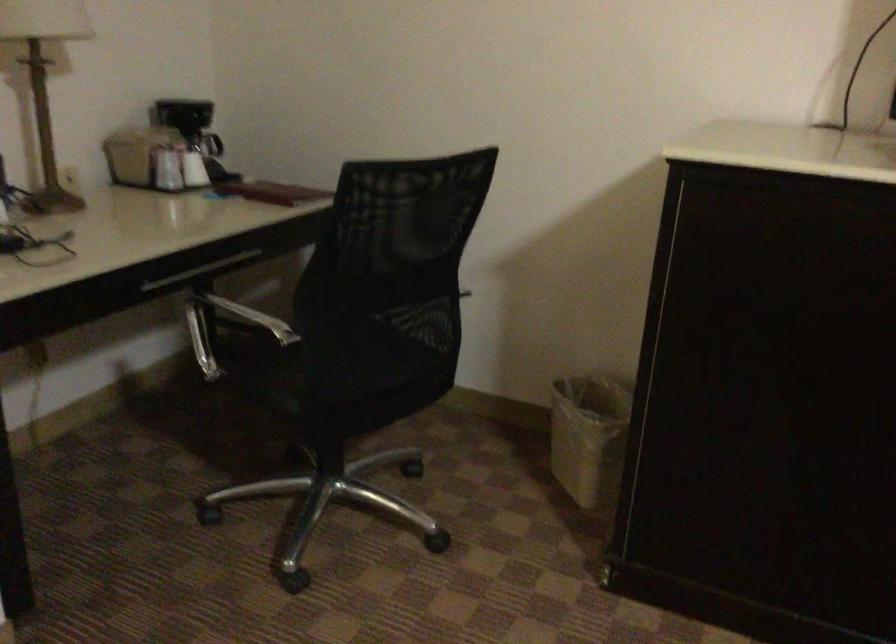
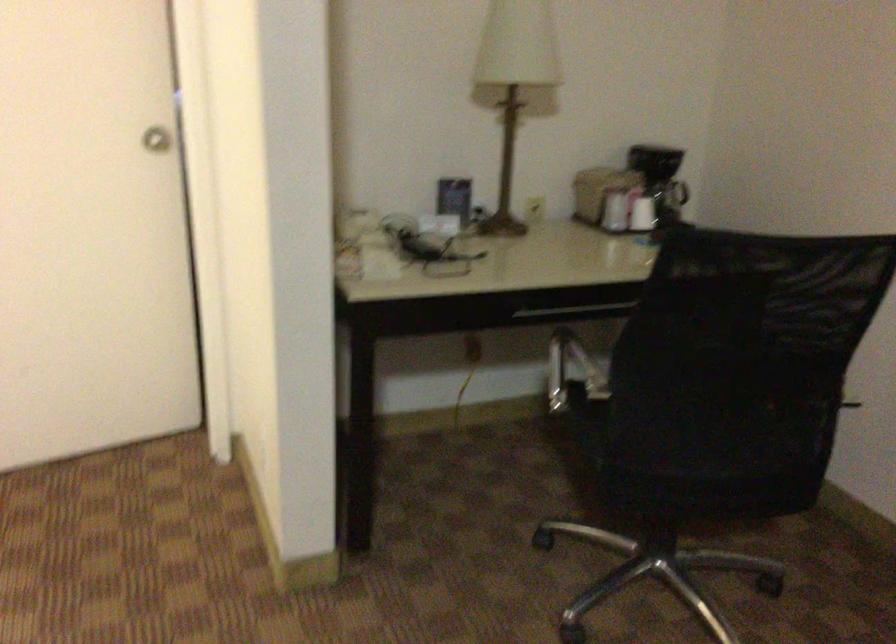
The point at [197,169] is marked in the first image. Where is the corresponding point in the second image?

(642, 214)